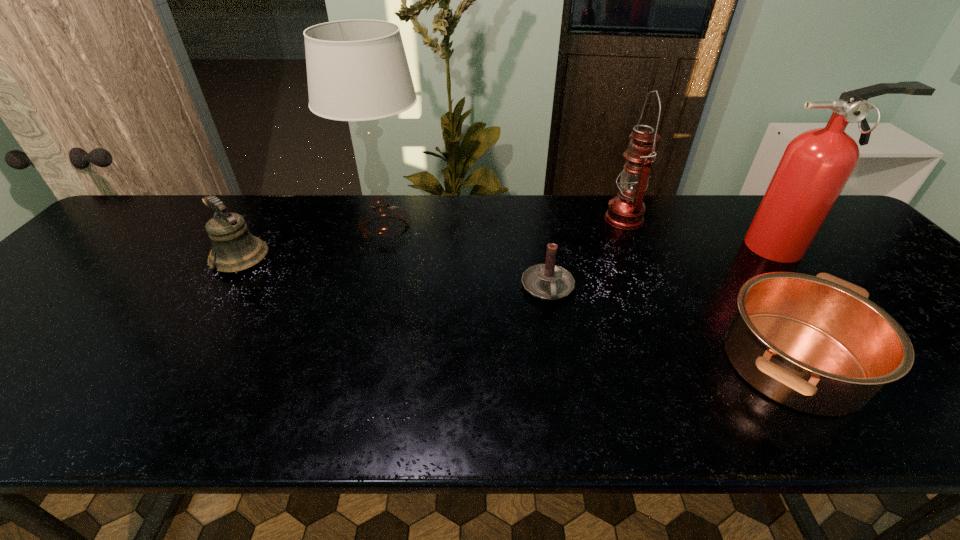
Where is `vacant region between the candle and the fire extinguisher`? Image resolution: width=960 pixels, height=540 pixels. vacant region between the candle and the fire extinguisher is located at coordinates (666, 268).

Where is `vacant area that lies between the saucepan and the candle`? Image resolution: width=960 pixels, height=540 pixels. vacant area that lies between the saucepan and the candle is located at coordinates (670, 325).

Identify which object is the fourth closest to the table lamp. Please provide its 2D coordinates. Your answer should be formatted as a tuple, i.e. [(x, y)], where the tuple contains the x and y coordinates of a point satisfying the conditions above.

[(816, 344)]

Select which object appears as the third closest to the candle. Please provide its 2D coordinates. Your answer should be formatted as a tuple, i.e. [(x, y)], where the tuple contains the x and y coordinates of a point satisfying the conditions above.

[(357, 70)]

Locate an element on the screen. free space that satisfies the following two spatial constraints: 1. on the front-facing side of the saucepan; 2. on the left side of the table lamp is located at coordinates (348, 361).

Where is `vacant space that satisfies the following two spatial constraints: 1. on the back side of the leftmost object; 2. on the right side of the oil lamp`? The height and width of the screenshot is (540, 960). vacant space that satisfies the following two spatial constraints: 1. on the back side of the leftmost object; 2. on the right side of the oil lamp is located at coordinates pos(267,219).